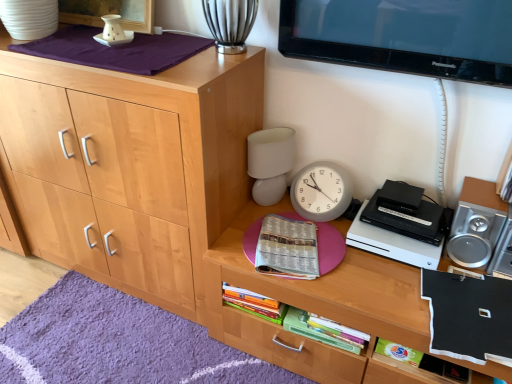
Where is `vacant region above wooden desk at center (from a real-world perspective)`? vacant region above wooden desk at center (from a real-world perspective) is located at coordinates (372, 265).